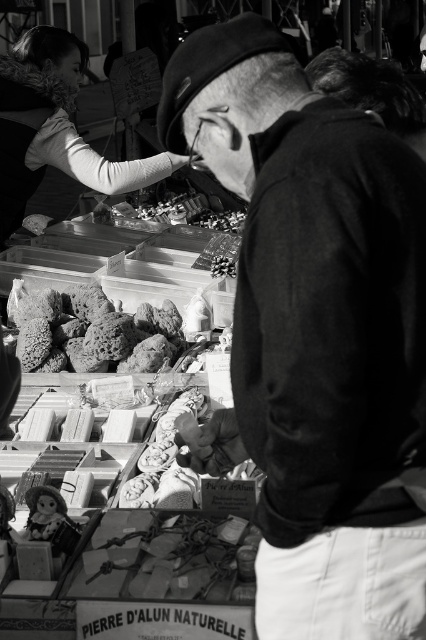
Can you confirm if matte black jacket at center is shorter than rough stone at center?

No.

Is matte black jacket at center to the left of rough stone at center from the viewer's perspective?

Incorrect, matte black jacket at center is not on the left side of rough stone at center.

Is point (288, 576) positioned in front of point (80, 336)?

That is True.

The image size is (426, 640). Identify the location of matte black jacket at center. (316, 333).

Who is more distant from viewer, [279,540] or [31,493]?

The point [31,493] is behind.

Does matte black jacket at center have a greater height compared to matte plastic doll at lower left?

Yes, matte black jacket at center is taller than matte plastic doll at lower left.

Identify the location of matte black jacket at center. This screenshot has height=640, width=426. (316, 333).

How distant is rough stone at center from matte plastic doll at lower left?

1.73 meters

Between point (164, 330) and point (46, 538), which one is positioned in front?

Positioned in front is point (46, 538).

Is point (40, 304) behind point (60, 506)?

Yes, point (40, 304) is behind point (60, 506).

Where is `rough stone at center`? This screenshot has height=640, width=426. rough stone at center is located at coordinates (85, 328).